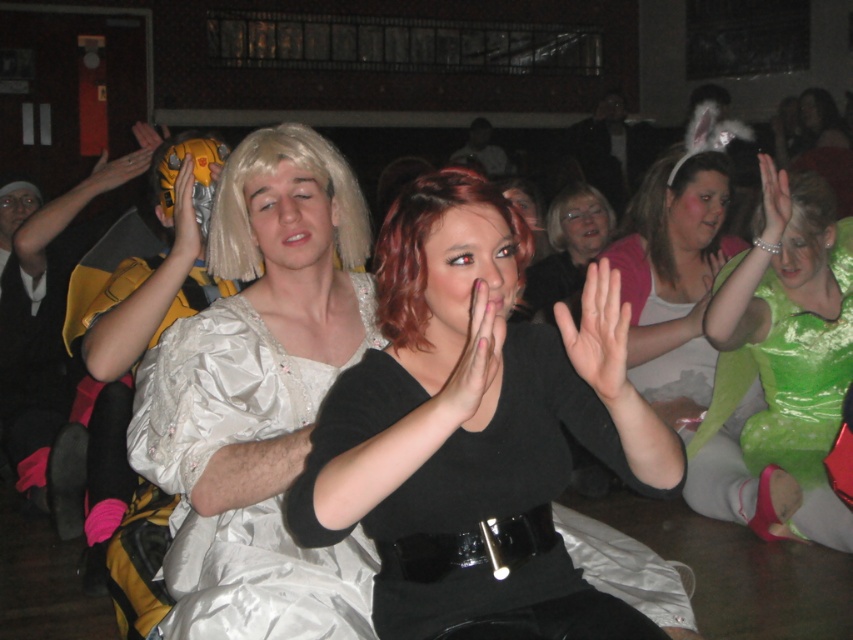
Can you confirm if satin black dress at center is wider than matte yellow glove at upper left?

Indeed, satin black dress at center has a greater width compared to matte yellow glove at upper left.

Which is more to the left, satin black dress at center or matte yellow glove at upper left?

matte yellow glove at upper left

Locate an element on the screen. The height and width of the screenshot is (640, 853). satin black dress at center is located at coordinates (260, 310).

In the scene shown: Which of these two, shiny silver dress at center or matte yellow glove at upper left, stands shorter?

matte yellow glove at upper left is shorter.

The height and width of the screenshot is (640, 853). In order to click on shiny silver dress at center in this screenshot , I will do `click(468, 416)`.

What do you see at coordinates (468, 416) in the screenshot? This screenshot has width=853, height=640. I see `shiny silver dress at center` at bounding box center [468, 416].

Find the location of a particular element. Image resolution: width=853 pixels, height=640 pixels. shiny silver dress at center is located at coordinates (468, 416).

In the scene shown: Does smooth green hand at upper right appear on the left side of matte yellow plastic at upper left?

In fact, smooth green hand at upper right is to the right of matte yellow plastic at upper left.

Who is lower down, smooth green hand at upper right or matte yellow plastic at upper left?

smooth green hand at upper right is below.

Is point (762, 195) in front of point (102, 182)?

Yes, it is.

Where is `smooth green hand at upper right`? The height and width of the screenshot is (640, 853). smooth green hand at upper right is located at coordinates (770, 202).